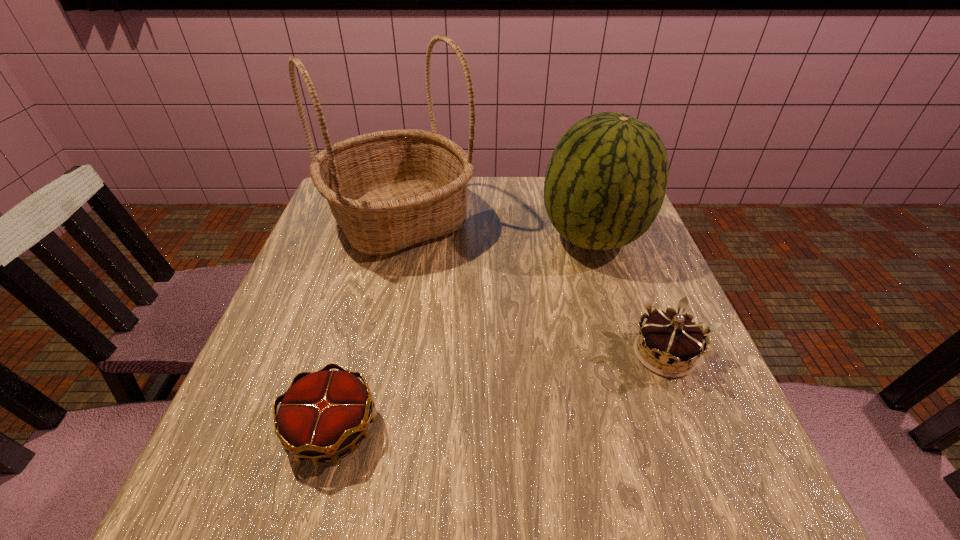
In order to click on free space at the far edge of the desktop in this screenshot , I will do (x=525, y=214).

Identify the location of vacant space at the near edge of the desktop. (379, 463).

The height and width of the screenshot is (540, 960). Identify the location of free region at the left edge. (245, 426).

In the image, there is a desktop. At what (x,y) coordinates should I click in order to perform the action: click on blank space at the right edge. Please return your answer as a coordinate pair (x, y). The height and width of the screenshot is (540, 960). Looking at the image, I should click on (650, 431).

This screenshot has height=540, width=960. What are the coordinates of `free space at the near left corner of the desktop` in the screenshot? It's located at (236, 480).

Find the location of a particular element. blank region between the tallest object and the shortest object is located at coordinates (366, 324).

Identify the location of free point between the watermelon and the third tallest object. (629, 295).

At what (x,y) coordinates should I click in order to perform the action: click on free spot between the third shortest object and the third tallest object. Please return your answer as a coordinate pair (x, y). Looking at the image, I should click on (629, 295).

What are the coordinates of `free space between the third shortest object and the basket` in the screenshot? It's located at (496, 228).

Find the location of `free spot between the second tallest object and the nearest object`. free spot between the second tallest object and the nearest object is located at coordinates (463, 333).